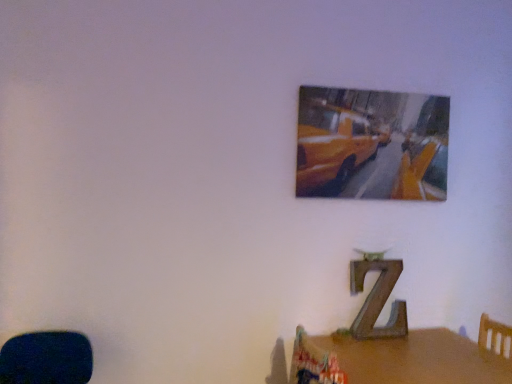
This screenshot has height=384, width=512. What do you see at coordinates (372, 144) in the screenshot? I see `metallic yellow taxi at upper center` at bounding box center [372, 144].

At what (x,y) coordinates should I click in order to perform the action: click on metallic yellow taxi at upper center. Please return your answer as a coordinate pair (x, y). The height and width of the screenshot is (384, 512). Looking at the image, I should click on (372, 144).

The image size is (512, 384). What do you see at coordinates (412, 359) in the screenshot?
I see `brown wooden table at lower right` at bounding box center [412, 359].

Where is `brown wooden table at lower right`? This screenshot has height=384, width=512. brown wooden table at lower right is located at coordinates (412, 359).

Locate an element on the screen. The image size is (512, 384). metallic yellow taxi at upper center is located at coordinates (372, 144).

Which object is positioned more to the right, metallic yellow taxi at upper center or brown wooden table at lower right?

Positioned to the right is brown wooden table at lower right.

Is metallic yellow taxi at upper center closer to camera compared to brown wooden table at lower right?

No, metallic yellow taxi at upper center is behind brown wooden table at lower right.

Does point (318, 126) come in front of point (476, 374)?

No.

From the image's perspective, is metallic yellow taxi at upper center beneath brown wooden table at lower right?

No, from the image's perspective, metallic yellow taxi at upper center is not below brown wooden table at lower right.

From a real-world perspective, is metallic yellow taxi at upper center over brown wooden table at lower right?

Yes, from a real-world perspective, metallic yellow taxi at upper center is above brown wooden table at lower right.

Does metallic yellow taxi at upper center have a greater width compared to brown wooden table at lower right?

No.

Considering the relative sizes of metallic yellow taxi at upper center and brown wooden table at lower right in the image provided, is metallic yellow taxi at upper center shorter than brown wooden table at lower right?

Incorrect, the height of metallic yellow taxi at upper center does not fall short of that of brown wooden table at lower right.

Considering the relative sizes of metallic yellow taxi at upper center and brown wooden table at lower right in the image provided, is metallic yellow taxi at upper center smaller than brown wooden table at lower right?

Indeed, metallic yellow taxi at upper center has a smaller size compared to brown wooden table at lower right.

Could brown wooden table at lower right be considered to be inside metallic yellow taxi at upper center?

No.

Are metallic yellow taxi at upper center and brown wooden table at lower right located far from each other?

No, metallic yellow taxi at upper center is not far from brown wooden table at lower right.

Consider the image. Is brown wooden table at lower right at the back of metallic yellow taxi at upper center?

That's not correct — metallic yellow taxi at upper center is not looking away from brown wooden table at lower right.

How far apart are metallic yellow taxi at upper center and brown wooden table at lower right?

metallic yellow taxi at upper center and brown wooden table at lower right are 37.84 inches apart.

Find the location of `picture frame that is above the brown wooden table at lower right (from the image's perspective)`. picture frame that is above the brown wooden table at lower right (from the image's perspective) is located at coordinates (372, 144).

Would you say brown wooden table at lower right is to the left or to the right of metallic yellow taxi at upper center in the picture?

From the image, it's evident that brown wooden table at lower right is to the right of metallic yellow taxi at upper center.

Considering the relative positions of brown wooden table at lower right and metallic yellow taxi at upper center in the image provided, is brown wooden table at lower right behind metallic yellow taxi at upper center?

No, the depth of brown wooden table at lower right is less than that of metallic yellow taxi at upper center.

Which is more distant, (380, 376) or (441, 103)?

Positioned behind is point (441, 103).

From the picture: From the image's perspective, is brown wooden table at lower right positioned above or below metallic yellow taxi at upper center?

From the image's perspective, brown wooden table at lower right appears below metallic yellow taxi at upper center.

From the picture: From a real-world perspective, which object stands above the other?

From a 3D spatial view, metallic yellow taxi at upper center is above.

Between brown wooden table at lower right and metallic yellow taxi at upper center, which one has smaller width?

metallic yellow taxi at upper center is thinner.

Considering the relative sizes of brown wooden table at lower right and metallic yellow taxi at upper center in the image provided, is brown wooden table at lower right taller than metallic yellow taxi at upper center?

No, brown wooden table at lower right is not taller than metallic yellow taxi at upper center.

Does brown wooden table at lower right have a smaller size compared to metallic yellow taxi at upper center?

No.

Is brown wooden table at lower right positioned beyond the bounds of metallic yellow taxi at upper center?

brown wooden table at lower right is positioned outside metallic yellow taxi at upper center.

Is brown wooden table at lower right not close to metallic yellow taxi at upper center?

They are positioned close to each other.

Consider the image. Is brown wooden table at lower right facing away from metallic yellow taxi at upper center?

No, brown wooden table at lower right's orientation is not away from metallic yellow taxi at upper center.

Can you tell me how much brown wooden table at lower right and metallic yellow taxi at upper center differ in facing direction?

The angular difference between brown wooden table at lower right and metallic yellow taxi at upper center is 0.126 degrees.

Locate an element on the screen. This screenshot has width=512, height=384. table in front of the metallic yellow taxi at upper center is located at coordinates (412, 359).

This screenshot has height=384, width=512. In order to click on picture frame that is above the brown wooden table at lower right (from the image's perspective) in this screenshot , I will do `click(372, 144)`.

The image size is (512, 384). In order to click on picture frame located on the left of brown wooden table at lower right in this screenshot , I will do `click(372, 144)`.